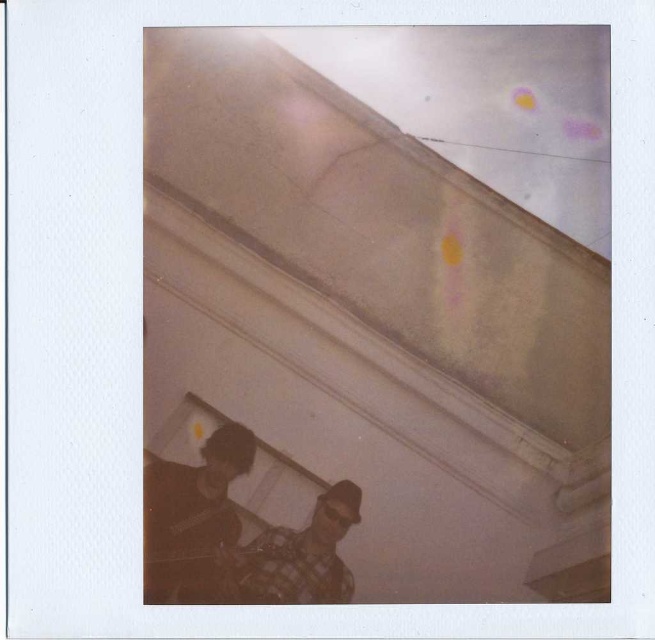
You are organizing a clothing store and need to arrange the dark brown leather jacket at lower left and the checkered fabric shirt at lower center on a rack. Since the rack has limited vertical space, which item should you place higher up to accommodate their sizes?

The dark brown leather jacket at lower left has a greater height compared to the checkered fabric shirt at lower center, so you should place the dark brown leather jacket at lower left higher up on the rack to accommodate its larger size.

You are organizing a clothing store and need to arrange the dark brown leather jacket at lower left and the checkered fabric shirt at lower center on a mannequin. Based on their positions in the photo, which clothing item should be placed on the left side of the mannequin?

The dark brown leather jacket at lower left should be placed on the left side of the mannequin because it is positioned to the left of the checkered fabric shirt at lower center in the photo.

You are organizing a charity clothing drive and need to pack items into boxes. You have a box that can only fit items with a thickness of 2 inches or less. You see the dark brown leather jacket at lower left and the checkered fabric shirt at lower center. Which item can be safely placed in the box?

The dark brown leather jacket at lower left is thinner than the checkered fabric shirt at lower center, so the dark brown leather jacket at lower left can be safely placed in the box since it meets the thickness requirement of 2 inches or less.